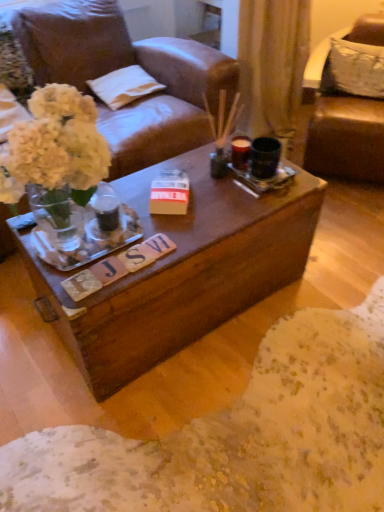
Question: Considering the positions of point (112, 97) and point (365, 48), is point (112, 97) closer or farther from the camera than point (365, 48)?

Choices:
 (A) farther
 (B) closer

Answer: (B)

Question: From a real-world perspective, is white cotton pillow at upper center, which appears as the 1th pillow when viewed from the left, above or below white fabric pillow at upper right, acting as the second pillow starting from the left?

Choices:
 (A) above
 (B) below

Answer: (B)

Question: Which object is positioned closest to the brown leather chair at upper right?

Choices:
 (A) white fabric pillow at upper right, the first pillow viewed from the right
 (B) white cotton pillow at upper center, which appears as the 1th pillow when viewed from the left

Answer: (A)

Question: Estimate the real-world distances between objects in this image. Which object is closer to the brown leather chair at upper right?

Choices:
 (A) white cotton pillow at upper center, which appears as the 1th pillow when viewed from the left
 (B) white fabric pillow at upper right, the first pillow viewed from the right

Answer: (B)